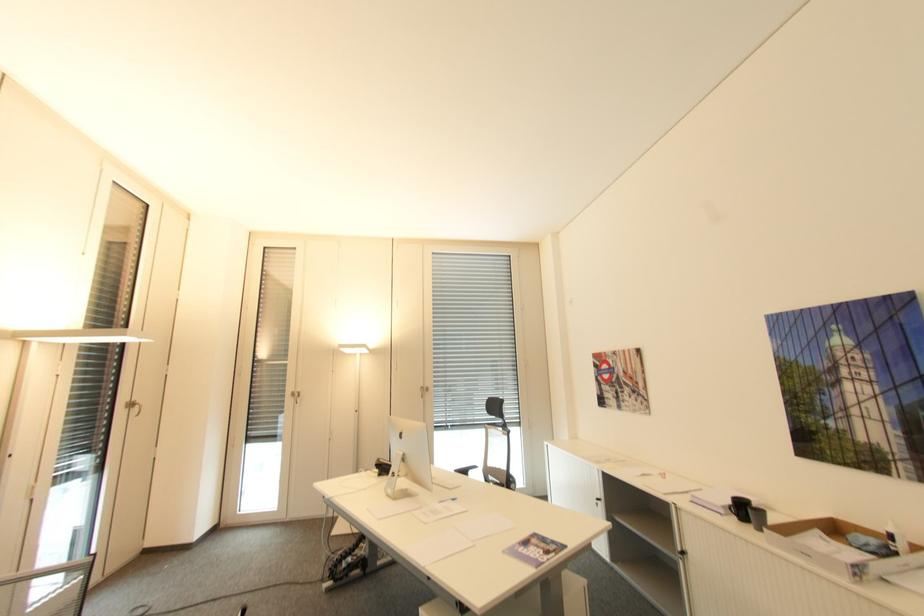
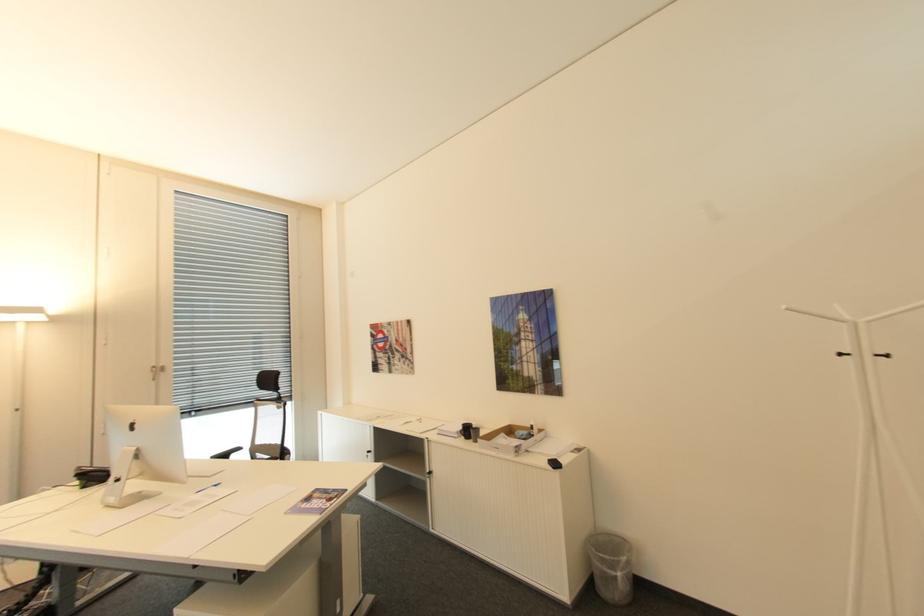
Question: The camera is either moving clockwise (left) or counter-clockwise (right) around the object. The first image is from the beginning of the video and the second image is from the end. Is the camera moving left or right when shooting the video?

Choices:
 (A) Left
 (B) Right

Answer: (A)